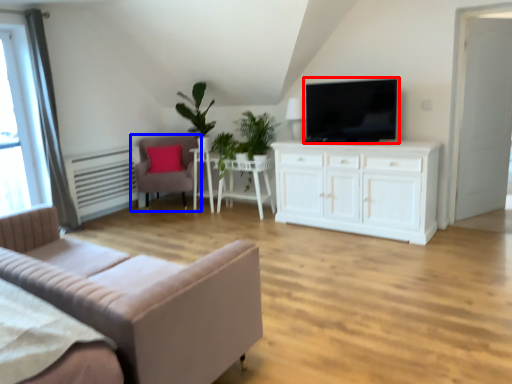
Question: Which point is closer to the camera, television (highlighted by a red box) or chair (highlighted by a blue box)?

Choices:
 (A) television
 (B) chair

Answer: (A)